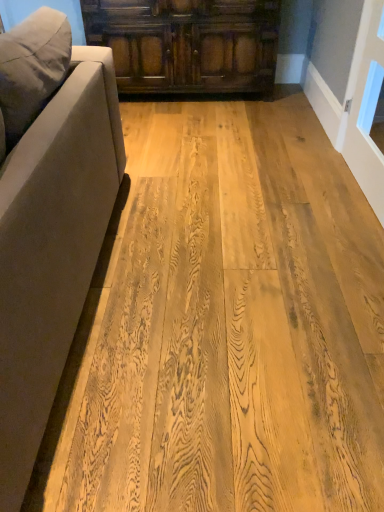
Where is `space that is in front of dark brown wood cabinet at upper center`? space that is in front of dark brown wood cabinet at upper center is located at coordinates (217, 136).